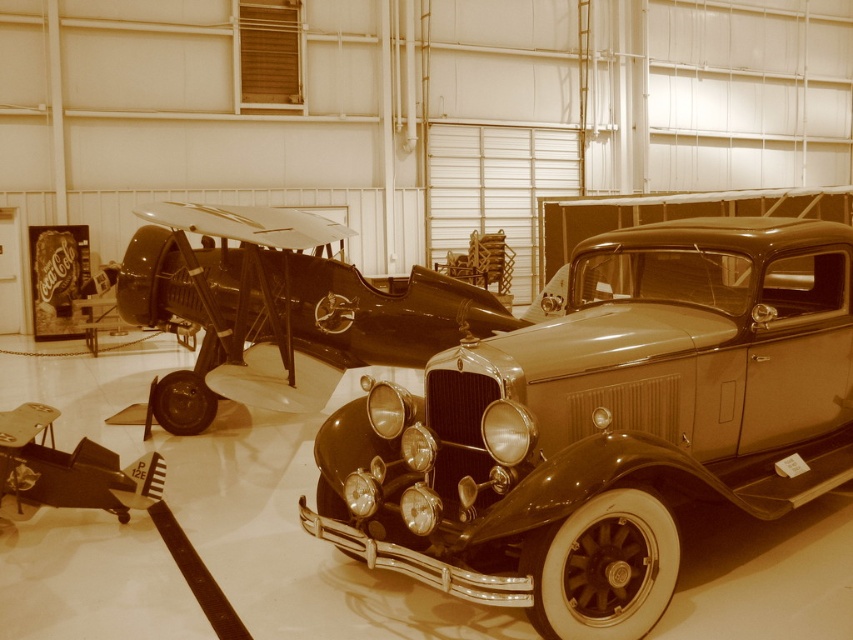
You are a photographer planning to take a picture of both the shiny black airplane at center and the metallic silver car at center. Since you want to emphasize the airplane in your composition, which object should you position closer to the camera to achieve this effect?

To emphasize the shiny black airplane at center in the composition, you should position it closer to the camera since it has a larger size compared to the metallic silver car at center, making it appear more prominent in the photo.

You are a photographer planning to take a photo of both the shiny black car at center and the metallic silver car at center. Since you want to emphasize the size difference between them, which car should you position closer to the camera to make it appear larger?

To emphasize the size difference between the shiny black car at center and the metallic silver car at center, you should position the metallic silver car at center closer to the camera. Since the shiny black car at center is actually bigger in real life, placing the smaller metallic silver car at center nearer will make both appear similar in size in the photo, thereby highlighting their actual size difference.

You are a visitor at the museum and want to take a photo of both the shiny black car at center and the shiny black airplane at center. Since you can only focus on one object at a time, which one should you focus on first to ensure the other is still in the background?

You should focus on the shiny black car at center first because it is closer to the viewer, allowing the shiny black airplane at center in the background to remain in focus.